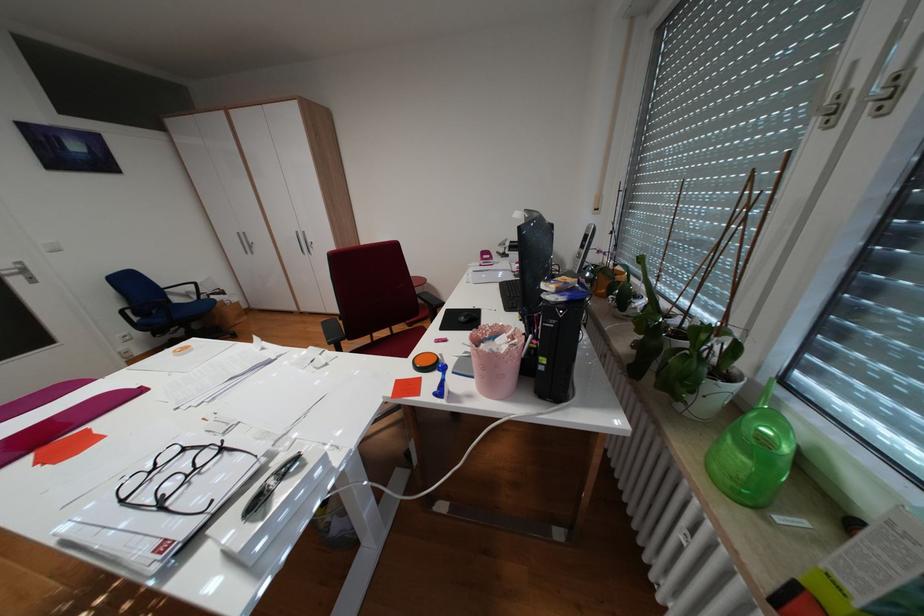
The image size is (924, 616). What are the coordinates of `pink pencil holder` in the screenshot? It's located at (495, 359).